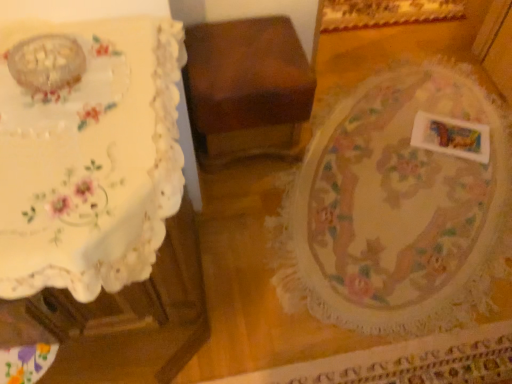
Question: Is floral lace tablecloth at center directly adjacent to white lace tablecloth at left?

Choices:
 (A) yes
 (B) no

Answer: (B)

Question: Considering the relative sizes of floral lace tablecloth at center and white lace tablecloth at left in the image provided, is floral lace tablecloth at center smaller than white lace tablecloth at left?

Choices:
 (A) yes
 (B) no

Answer: (B)

Question: Can you confirm if floral lace tablecloth at center is taller than white lace tablecloth at left?

Choices:
 (A) no
 (B) yes

Answer: (A)

Question: Is floral lace tablecloth at center far from white lace tablecloth at left?

Choices:
 (A) no
 (B) yes

Answer: (A)

Question: Is floral lace tablecloth at center looking in the opposite direction of white lace tablecloth at left?

Choices:
 (A) yes
 (B) no

Answer: (B)

Question: Considering the positions of floral lace tablecloth at center and wooden box at center in the image, is floral lace tablecloth at center wider or thinner than wooden box at center?

Choices:
 (A) wide
 (B) thin

Answer: (A)

Question: In the image, is floral lace tablecloth at center positioned in front of or behind wooden box at center?

Choices:
 (A) front
 (B) behind

Answer: (A)

Question: Is floral lace tablecloth at center spatially inside wooden box at center, or outside of it?

Choices:
 (A) inside
 (B) outside

Answer: (B)

Question: Would you say floral lace tablecloth at center is to the left or to the right of wooden box at center in the picture?

Choices:
 (A) right
 (B) left

Answer: (A)

Question: Is wooden box at center taller or shorter than floral lace tablecloth at center?

Choices:
 (A) tall
 (B) short

Answer: (A)

Question: Considering their positions, is wooden box at center located in front of or behind floral lace tablecloth at center?

Choices:
 (A) front
 (B) behind

Answer: (B)

Question: Considering the positions of wooden box at center and floral lace tablecloth at center in the image, is wooden box at center wider or thinner than floral lace tablecloth at center?

Choices:
 (A) thin
 (B) wide

Answer: (A)

Question: From a real-world perspective, is wooden box at center positioned above or below floral lace tablecloth at center?

Choices:
 (A) below
 (B) above

Answer: (B)

Question: Is floral lace tablecloth at center inside the boundaries of white matte rectangular object at lower right, or outside?

Choices:
 (A) outside
 (B) inside

Answer: (A)

Question: Considering the positions of floral lace tablecloth at center and white matte rectangular object at lower right in the image, is floral lace tablecloth at center taller or shorter than white matte rectangular object at lower right?

Choices:
 (A) short
 (B) tall

Answer: (A)